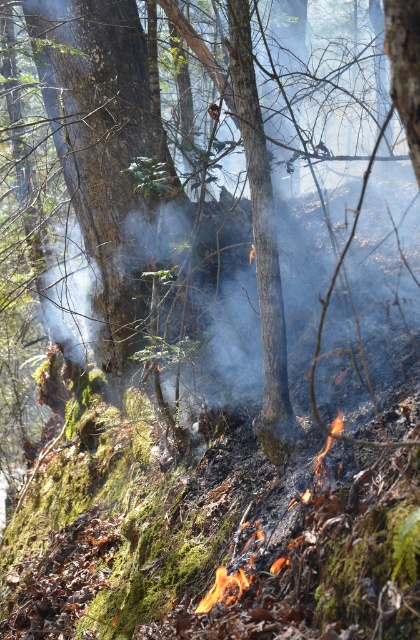
Question: Does green mossy tree at center appear under flaming charred debris at lower center?

Choices:
 (A) no
 (B) yes

Answer: (A)

Question: Which point is farther from the camera taking this photo?

Choices:
 (A) [x=225, y=582]
 (B) [x=128, y=20]

Answer: (B)

Question: Can you confirm if green mossy tree at center is positioned to the left of flaming charred debris at lower center?

Choices:
 (A) yes
 (B) no

Answer: (A)

Question: Does green mossy tree at center appear over flaming charred debris at lower center?

Choices:
 (A) no
 (B) yes

Answer: (B)